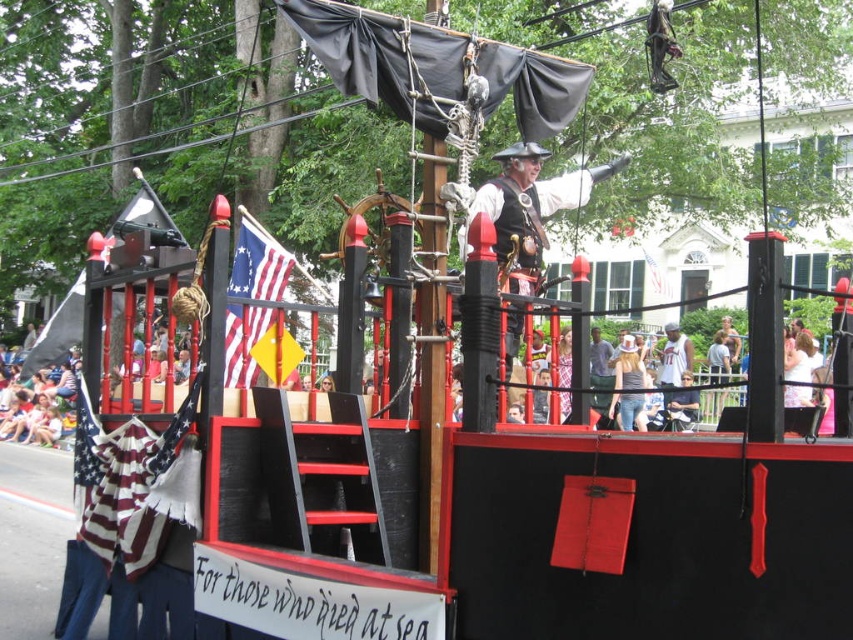
Does point (521, 220) come in front of point (231, 340)?

No.

Between matte black pirate at center and american flag at center, which one is positioned higher?

Positioned higher is matte black pirate at center.

Locate an element on the screen. matte black pirate at center is located at coordinates (531, 208).

The image size is (853, 640). I want to click on matte black pirate at center, so pyautogui.click(x=531, y=208).